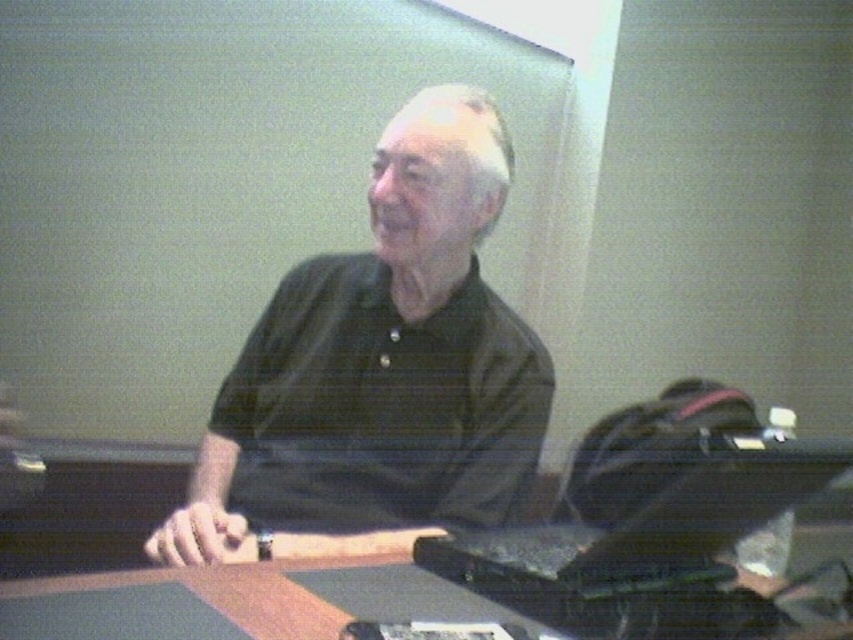
Question: Which of the following is the farthest from the observer?

Choices:
 (A) black matte shirt at center
 (B) black textured laptop at center

Answer: (A)

Question: Is black matte shirt at center wider than black textured laptop at center?

Choices:
 (A) yes
 (B) no

Answer: (A)

Question: Considering the real-world distances, which object is farthest from the black matte shirt at center?

Choices:
 (A) smooth wooden table at center
 (B) black textured laptop at center

Answer: (A)

Question: Is black textured laptop at center bigger than smooth wooden table at center?

Choices:
 (A) yes
 (B) no

Answer: (A)

Question: Based on their relative distances, which object is nearer to the black textured laptop at center?

Choices:
 (A) black matte shirt at center
 (B) smooth wooden table at center

Answer: (B)

Question: Where is black matte shirt at center located in relation to smooth wooden table at center in the image?

Choices:
 (A) above
 (B) below

Answer: (A)